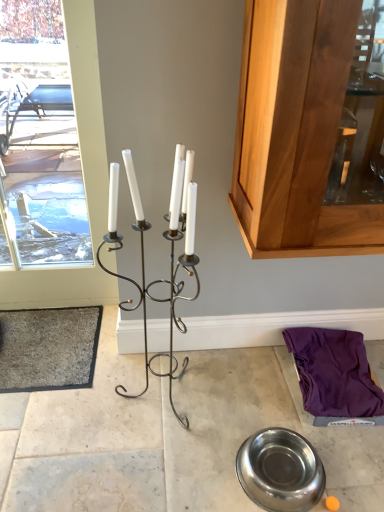
Where is `vacant area that lies between black wrought iron candle holder at center and polished stainless steel bowl at lower center`? vacant area that lies between black wrought iron candle holder at center and polished stainless steel bowl at lower center is located at coordinates (210, 435).